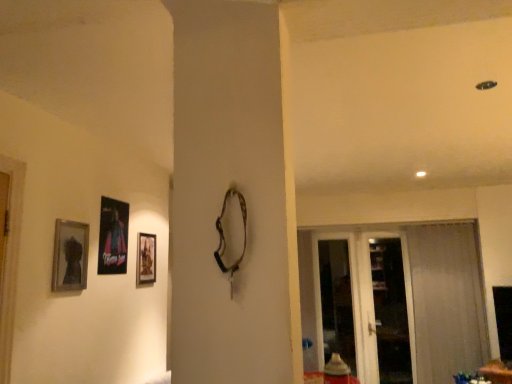
Question: Is metallic poster at left, which appears as the 2th picture frame when viewed from the front, facing towards transparent glass screen door at right, acting as the second screen door starting from the right?

Choices:
 (A) yes
 (B) no

Answer: (B)

Question: Can you confirm if metallic poster at left, placed as the 2th picture frame when sorted from right to left, is taller than transparent glass screen door at right, marked as the first screen door in a left-to-right arrangement?

Choices:
 (A) no
 (B) yes

Answer: (A)

Question: Considering the relative positions of metallic poster at left, placed as the 2th picture frame when sorted from right to left, and transparent glass screen door at right, marked as the first screen door in a left-to-right arrangement, in the image provided, is metallic poster at left, placed as the 2th picture frame when sorted from right to left, behind transparent glass screen door at right, marked as the first screen door in a left-to-right arrangement,?

Choices:
 (A) yes
 (B) no

Answer: (B)

Question: Considering the relative sizes of metallic poster at left, placed as the 2th picture frame when sorted from back to front, and transparent glass screen door at right, marked as the first screen door in a left-to-right arrangement, in the image provided, is metallic poster at left, placed as the 2th picture frame when sorted from back to front, bigger than transparent glass screen door at right, marked as the first screen door in a left-to-right arrangement,?

Choices:
 (A) yes
 (B) no

Answer: (B)

Question: Can you confirm if metallic poster at left, which appears as the 2th picture frame when viewed from the front, is wider than transparent glass screen door at right, acting as the second screen door starting from the right?

Choices:
 (A) yes
 (B) no

Answer: (B)

Question: Considering the relative sizes of metallic poster at left, the second picture frame viewed from the left, and transparent glass screen door at right, marked as the first screen door in a left-to-right arrangement, in the image provided, is metallic poster at left, the second picture frame viewed from the left, smaller than transparent glass screen door at right, marked as the first screen door in a left-to-right arrangement,?

Choices:
 (A) no
 (B) yes

Answer: (B)

Question: Can you confirm if matte black picture frame at left, the first picture frame in the front-to-back sequence, is smaller than matte wooden picture frame at center, the 1th picture frame from the right?

Choices:
 (A) yes
 (B) no

Answer: (B)

Question: Is matte black picture frame at left, which ranks as the 3th picture frame in right-to-left order, taller than matte wooden picture frame at center, which is the 3th picture frame from front to back?

Choices:
 (A) no
 (B) yes

Answer: (A)

Question: Is matte black picture frame at left, the first picture frame in the front-to-back sequence, positioned with its back to matte wooden picture frame at center, the 1th picture frame from the right?

Choices:
 (A) yes
 (B) no

Answer: (B)

Question: From the image's perspective, is matte black picture frame at left, which is the 3th picture frame from back to front, on matte wooden picture frame at center, which is the 3th picture frame from front to back?

Choices:
 (A) no
 (B) yes

Answer: (B)

Question: Is there a large distance between matte black picture frame at left, acting as the first picture frame starting from the left, and matte wooden picture frame at center, the first picture frame viewed from the back?

Choices:
 (A) no
 (B) yes

Answer: (A)

Question: Is matte black picture frame at left, acting as the first picture frame starting from the left, positioned before matte wooden picture frame at center, placed as the third picture frame when sorted from left to right?

Choices:
 (A) yes
 (B) no

Answer: (A)

Question: Would you say sheer white curtain at right contains matte black picture frame at left, which ranks as the 3th picture frame in right-to-left order?

Choices:
 (A) yes
 (B) no

Answer: (B)